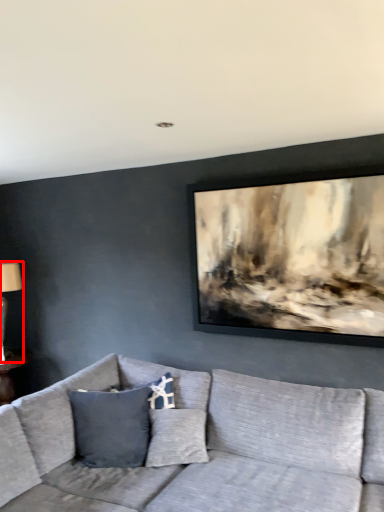
Question: Where is table lamp (annotated by the red box) located in relation to studio couch in the image?

Choices:
 (A) left
 (B) right

Answer: (A)